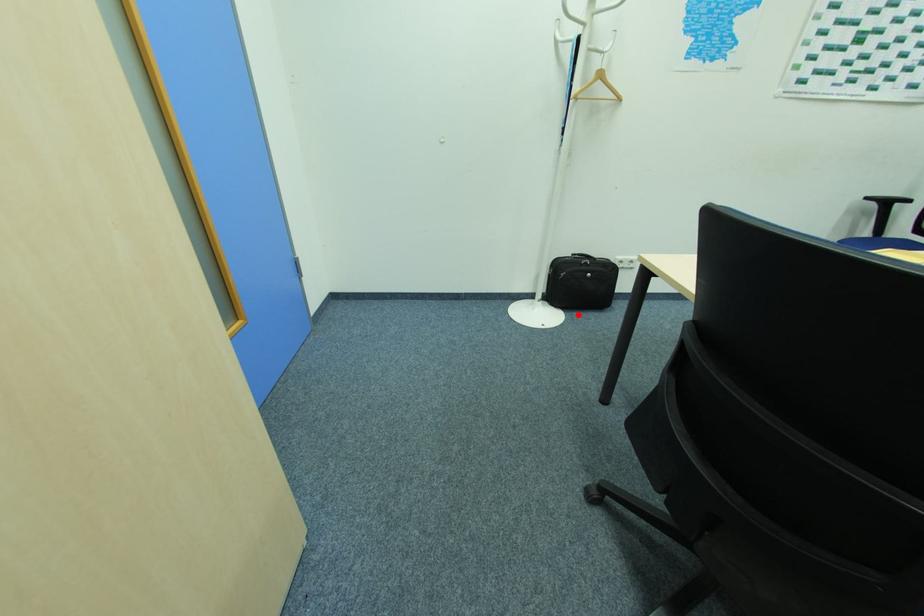
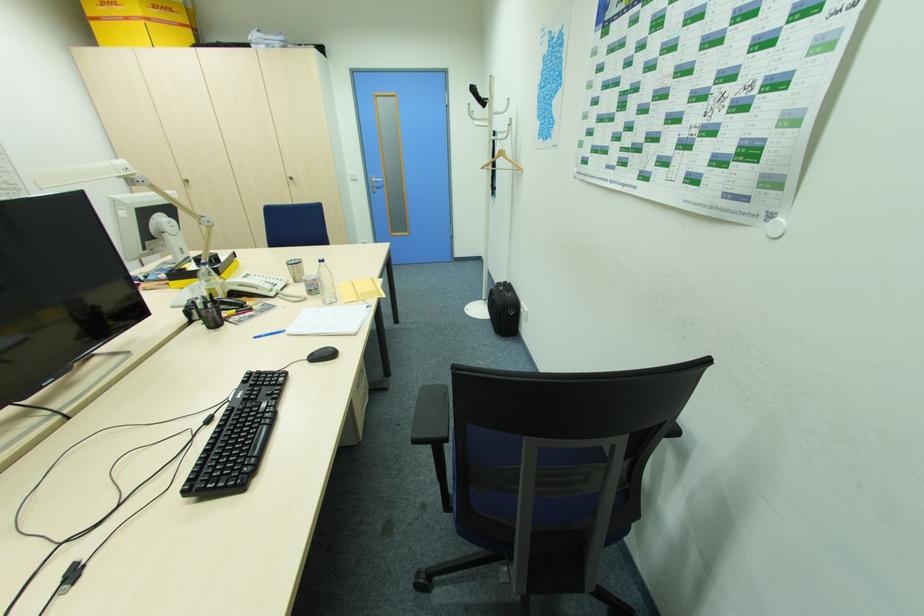
Question: I am providing you with two images of the same scene from different viewpoints. In image1, a red point is highlighted. Considering the same 3D point in image2, which of the following is correct?

Choices:
 (A) It is closer
 (B) It is farther

Answer: (A)